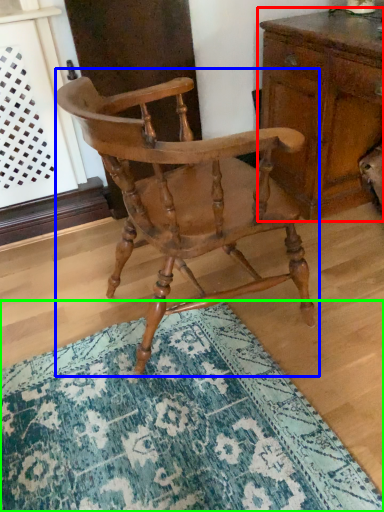
Question: Which is nearer to the chest of drawers (highlighted by a red box)? chair (highlighted by a blue box) or doormat (highlighted by a green box).

Choices:
 (A) chair
 (B) doormat

Answer: (A)